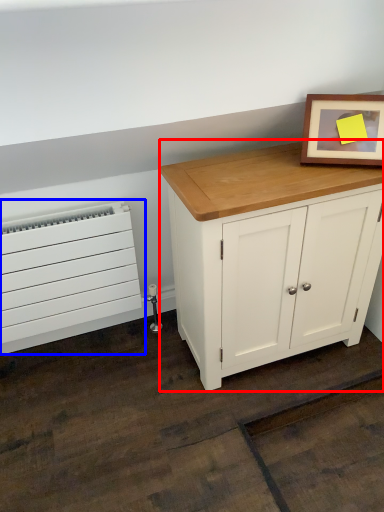
Question: Which object appears closest to the camera in this image, chest of drawers (highlighted by a red box) or heater (highlighted by a blue box)?

Choices:
 (A) chest of drawers
 (B) heater

Answer: (A)